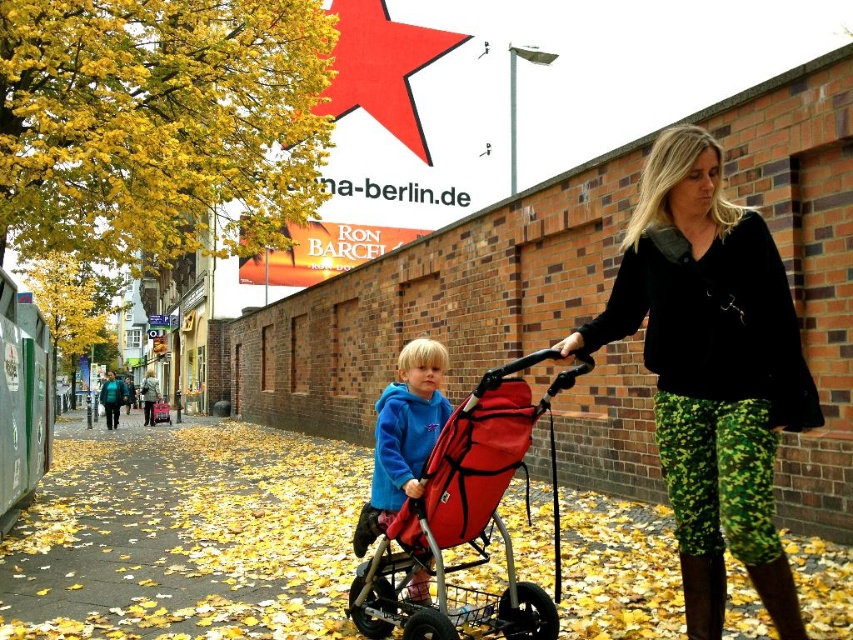
You are a pedestrian trying to cross the street safely. You notice the camouflage pants at center and the red matte star at upper center in your view. How far apart are these two objects from each other?

The camouflage pants at center and the red matte star at upper center are 80.20 meters apart.

You are a delivery person who needs to deliver a package to the address shown on the billboard. You see a woman with camouflage pants at center. Where should you approach her to ask for directions?

You should approach the woman with camouflage pants at center at point (x=711, y=371) to ask for directions.